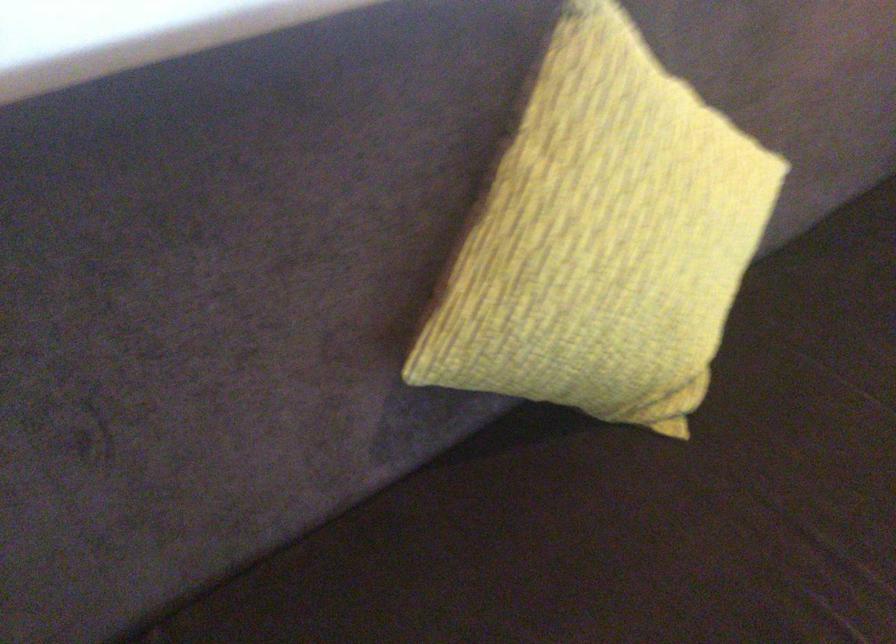
In order to click on sofa sitting surface in this screenshot , I will do `click(231, 210)`.